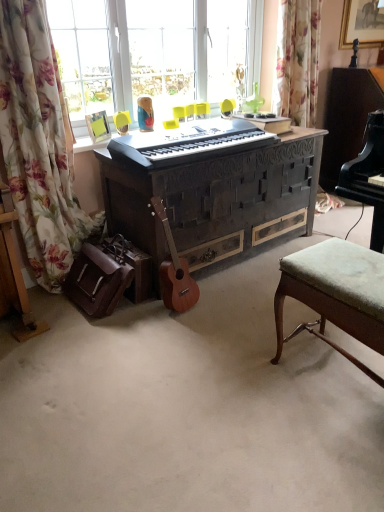
You are a GUI agent. You are given a task and a screenshot of the screen. Output one action in this format:
    pyautogui.click(x=<x>, y=<y>)
    Task: Click on the vacant area to the left of green fabric stool at lower right
    The width and height of the screenshot is (384, 512).
    Given the screenshot: What is the action you would take?
    pyautogui.click(x=246, y=392)